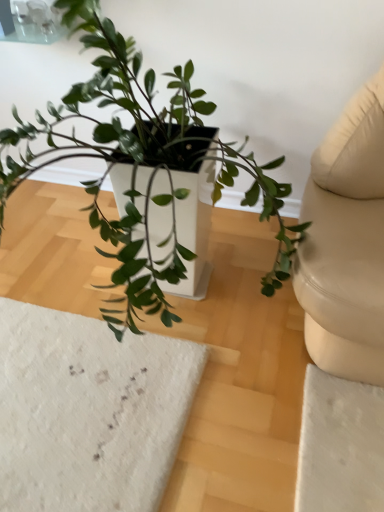
What are the coordinates of `vacant region below green matte plant at center (from a real-world perspective)` in the screenshot? It's located at (184, 297).